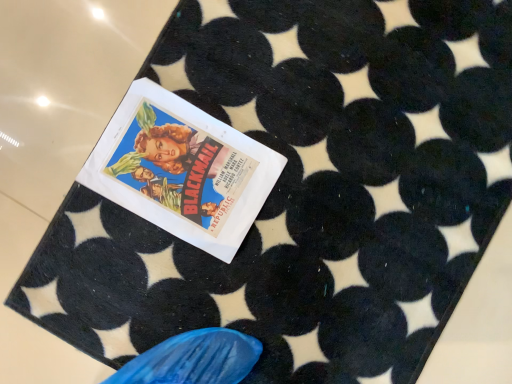
Question: Should I look upward or downward to see white paper poster at center?

Choices:
 (A) up
 (B) down

Answer: (A)